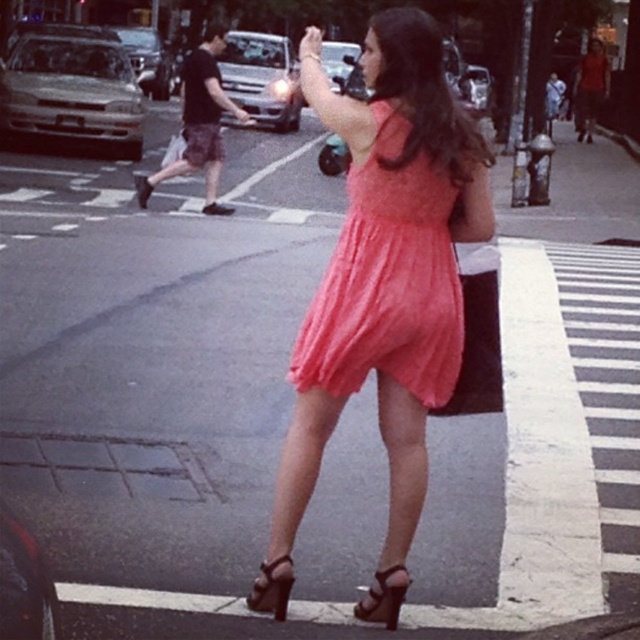
Looking at this image, you are a fashion designer observing this scene. You notice the coral fabric dress at center and the shiny brown sandal at lower center. Which item is taller?

The coral fabric dress at center is taller than the shiny brown sandal at lower center.

You are a fashion designer observing this scene. You need to determine if the coral chiffon dress at center and the brown leather sandal at lower center can be paired together in a runway show. Based on their spatial relationship, can they be considered part of the same outfit?

The coral chiffon dress at center and brown leather sandal at lower center are 1.03 meters apart, which suggests they belong to the same person and can be paired together in a runway show.